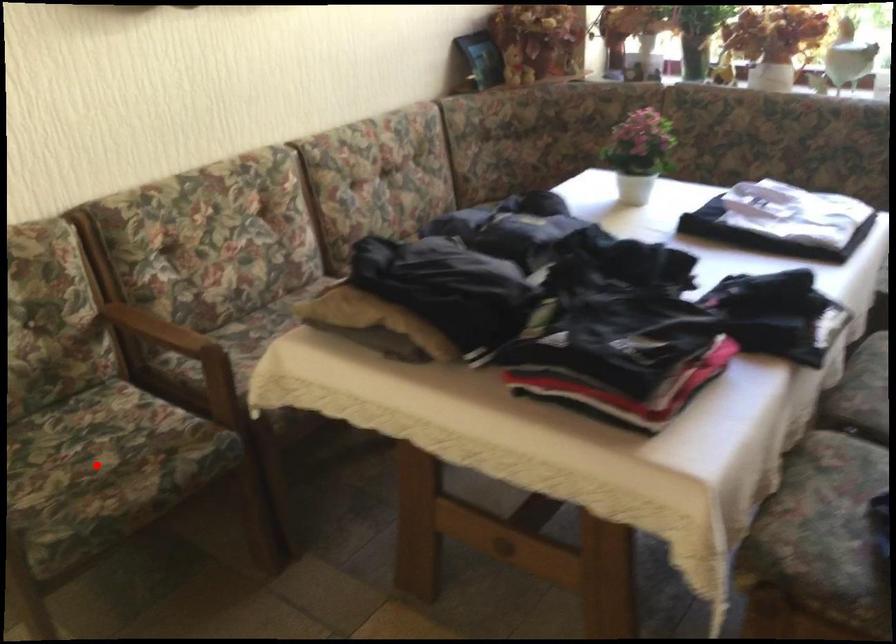
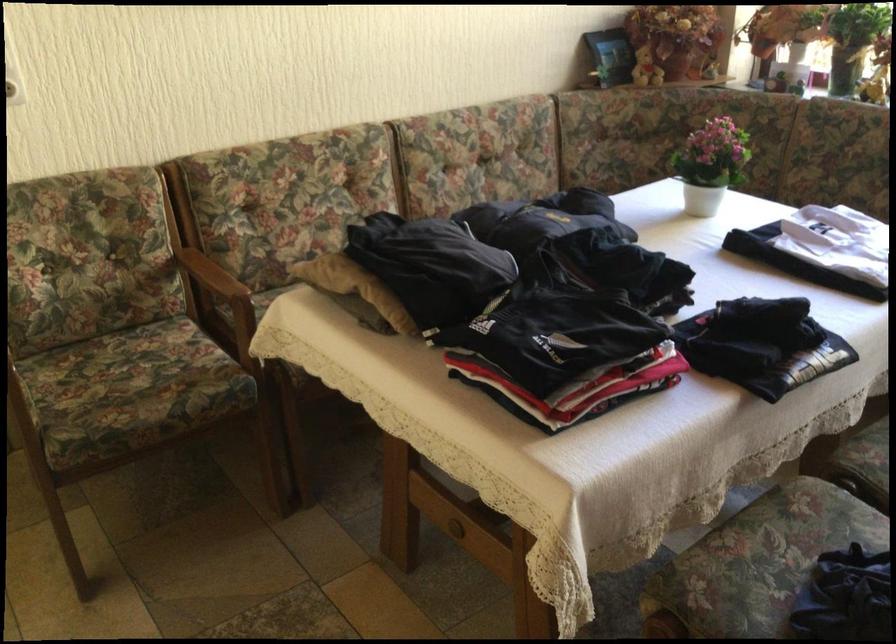
Where in the second image is the point corresponding to the highlighted location from the first image?

(130, 383)